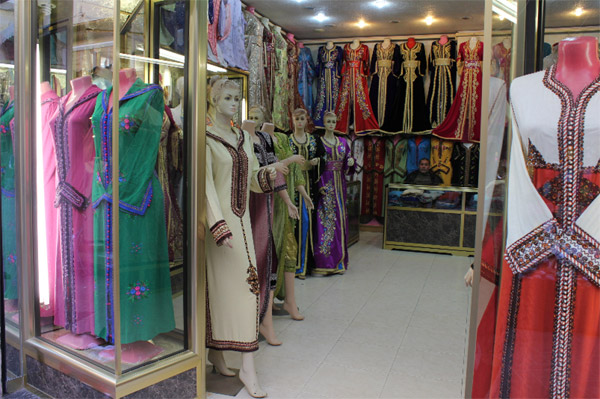
What are the coordinates of `image of a clothing store` in the screenshot? It's located at (259, 50).